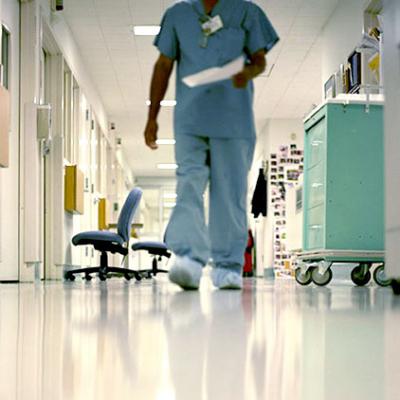
Locate an element on the screen. This screenshot has width=400, height=400. swivel chair is located at coordinates point(152,247), point(94,238).